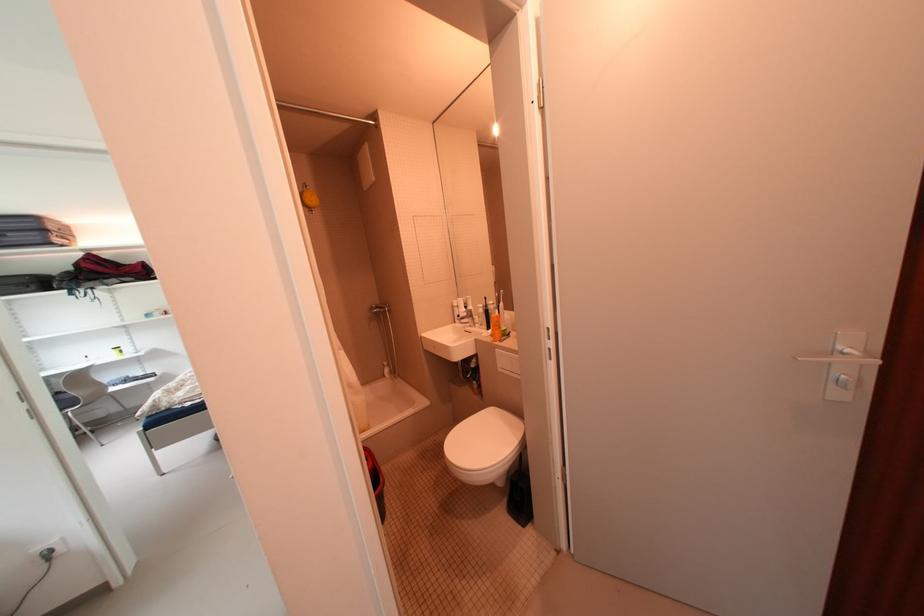
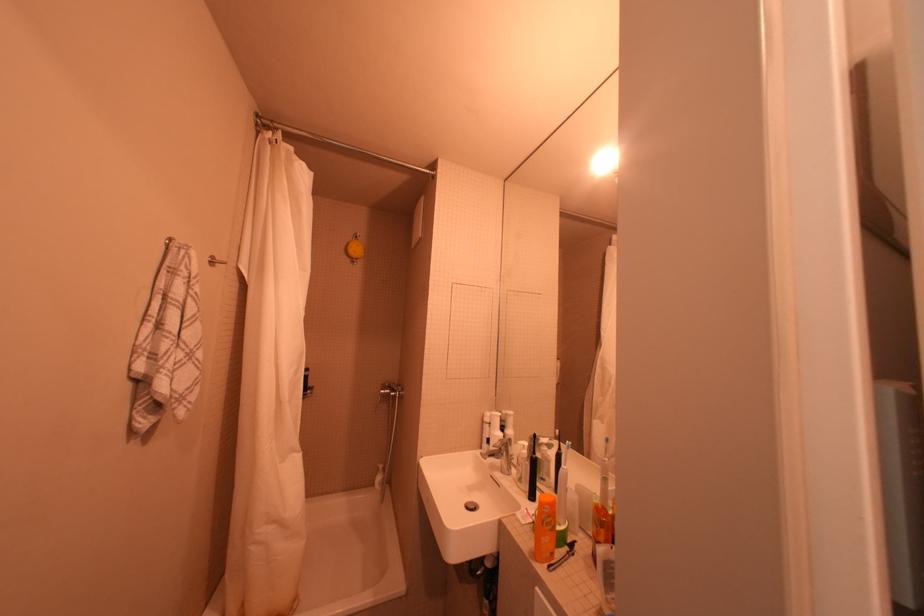
Question: How did the camera likely rotate?

Choices:
 (A) Left
 (B) Right
 (C) Up
 (D) Down

Answer: (A)